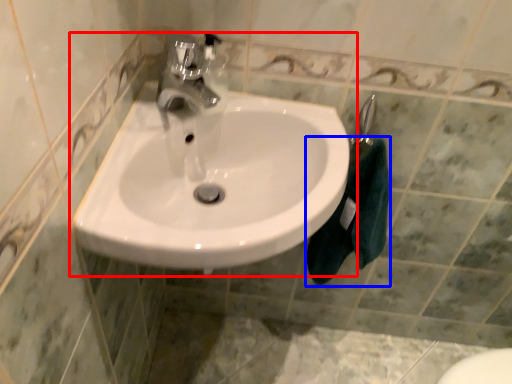
Question: Among these objects, which one is nearest to the camera, sink (highlighted by a red box) or bath towel (highlighted by a blue box)?

Choices:
 (A) sink
 (B) bath towel

Answer: (A)